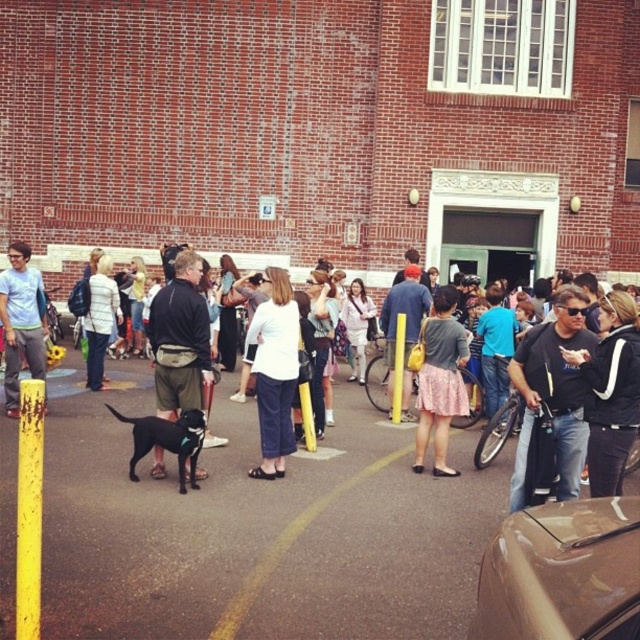
You are a photographer trying to capture the scene in front of the red brick building. You notice the matte blue shirt at left and the yellow asphalt at center. Which object should you focus on to ensure it appears larger in your photo?

The matte blue shirt at left is bigger than the yellow asphalt at center, so focusing on the matte blue shirt at left will ensure it appears larger in the photo.